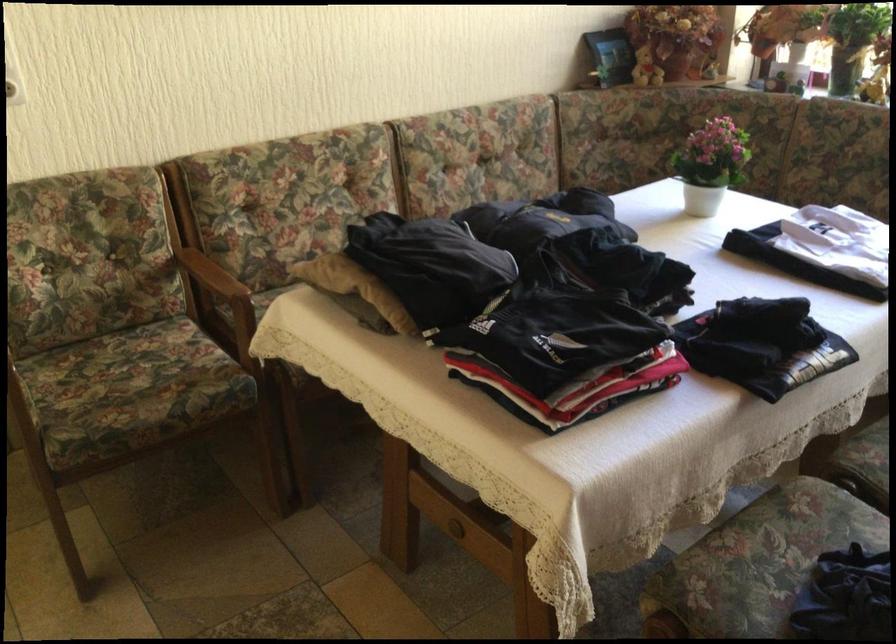
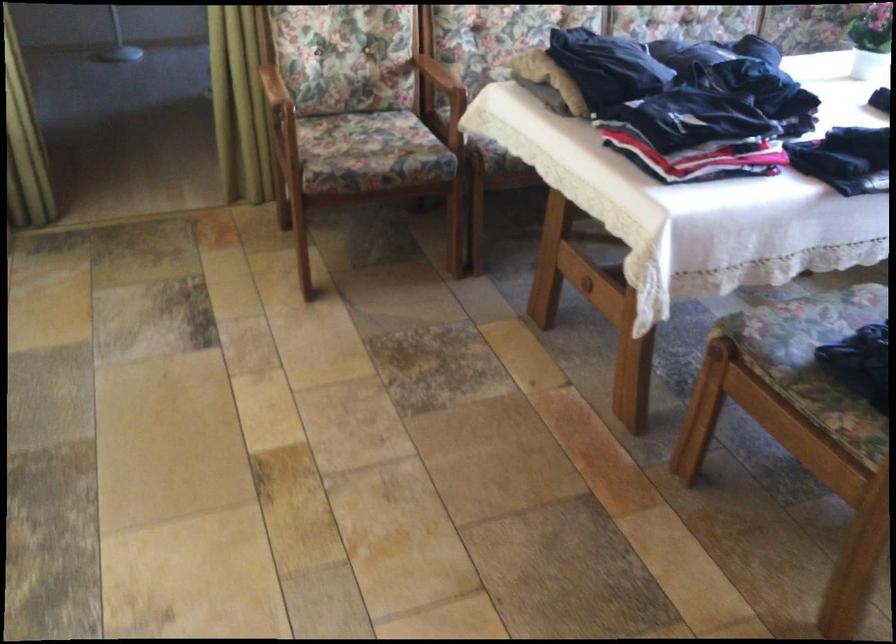
Question: How did the camera likely rotate?

Choices:
 (A) Left
 (B) Right
 (C) Up
 (D) Down

Answer: (A)